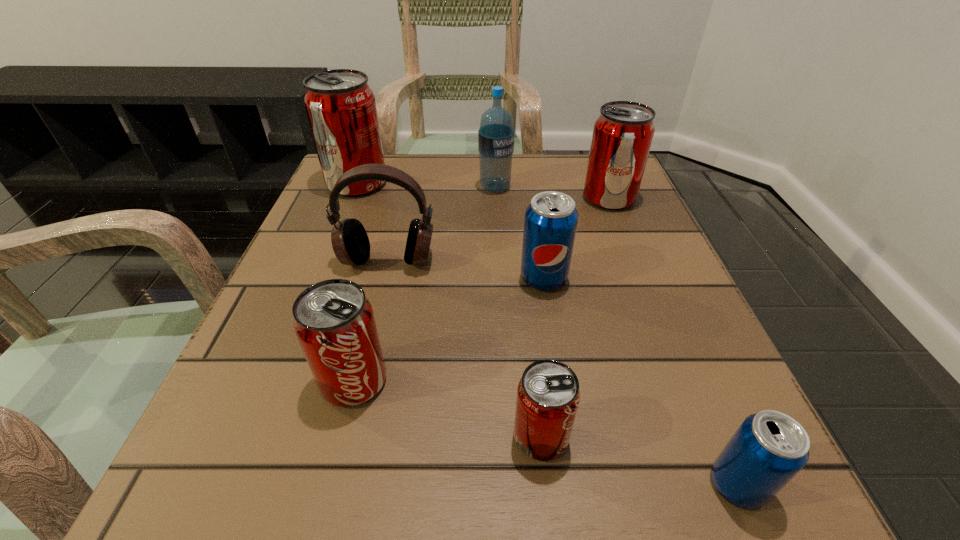
This screenshot has width=960, height=540. In order to click on the nearer blue pop soda in this screenshot , I will do `click(769, 448)`.

Find the location of a particular element. The image size is (960, 540). the smallest red pop soda is located at coordinates (548, 395).

Identify the location of the third red pop soda from left to right. (548, 395).

Image resolution: width=960 pixels, height=540 pixels. I want to click on blank area located on the front of the biggest red pop soda, so click(317, 284).

The height and width of the screenshot is (540, 960). Identify the location of vacant space located on the right of the blue water bottle. (612, 187).

You are a GUI agent. You are given a task and a screenshot of the screen. Output one action in this format:
    pyautogui.click(x=<x>, y=<y>)
    Task: Click on the free space located on the left of the rightmost red pop soda
    The width and height of the screenshot is (960, 540).
    Given the screenshot: What is the action you would take?
    pyautogui.click(x=551, y=198)

Where is `free space located 0.070m on the ear pads of the headset`? The height and width of the screenshot is (540, 960). free space located 0.070m on the ear pads of the headset is located at coordinates (377, 305).

Image resolution: width=960 pixels, height=540 pixels. I want to click on vacant space situated 0.390m on the back of the bigger blue pop soda, so [525, 161].

Image resolution: width=960 pixels, height=540 pixels. In order to click on vacant space located 0.100m on the left of the third biggest red pop soda in this screenshot , I will do `click(249, 381)`.

I want to click on vacant space located on the left of the smaller blue pop soda, so click(x=667, y=484).